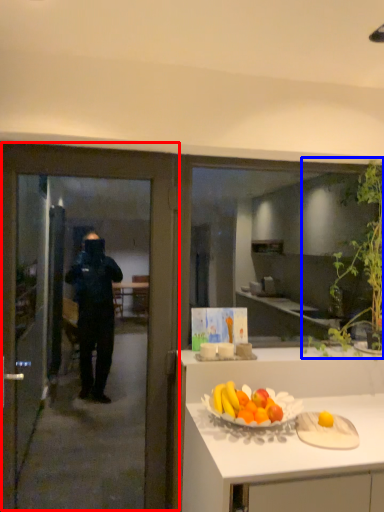
Question: Which object is further to the camera taking this photo, door (highlighted by a red box) or plant (highlighted by a blue box)?

Choices:
 (A) door
 (B) plant

Answer: (B)